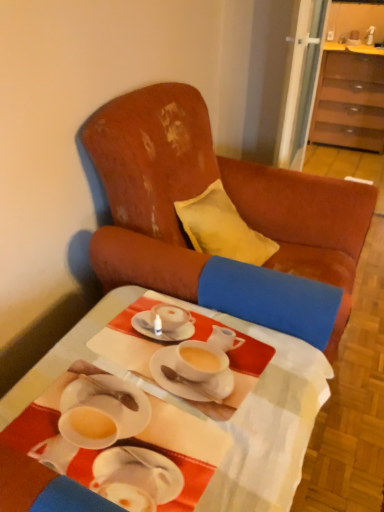
Question: Considering the positions of point (372, 96) and point (94, 243), is point (372, 96) closer or farther from the camera than point (94, 243)?

Choices:
 (A) closer
 (B) farther

Answer: (B)

Question: From the image's perspective, relative to distressed leather armchair at center, is brown wood cabinet at upper right above or below?

Choices:
 (A) below
 (B) above

Answer: (B)

Question: Which of these objects is positioned farthest from the brown wood cabinet at upper right?

Choices:
 (A) white glossy table at center
 (B) distressed leather armchair at center

Answer: (A)

Question: Which is farther from the white glossy table at center?

Choices:
 (A) distressed leather armchair at center
 (B) brown wood cabinet at upper right

Answer: (B)